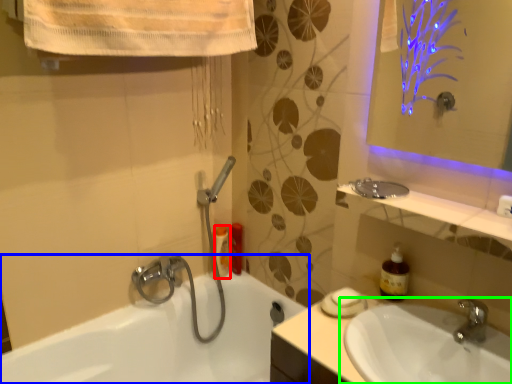
Question: Which object is the closest to the toiletry (highlighted by a red box)? Choose among these: bathtub (highlighted by a blue box) or sink (highlighted by a green box).

Choices:
 (A) bathtub
 (B) sink

Answer: (A)